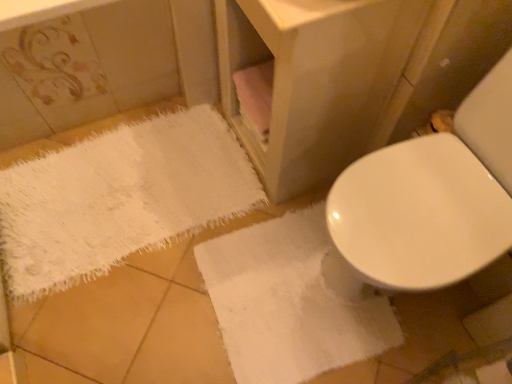
Question: Considering the positions of white fluffy bath towel at lower right, the first bath towel positioned from the right, and matte wood vanity at center in the image, is white fluffy bath towel at lower right, the first bath towel positioned from the right, wider or thinner than matte wood vanity at center?

Choices:
 (A) wide
 (B) thin

Answer: (A)

Question: In the image, is white fluffy bath towel at lower right, which is the second bath towel in left-to-right order, on the left side or the right side of matte wood vanity at center?

Choices:
 (A) right
 (B) left

Answer: (A)

Question: Considering the real-world distances, which object is closest to the white fluffy bath towel at lower right, which is the second bath towel in left-to-right order?

Choices:
 (A) white fluffy bath towel at lower left, the first bath towel positioned from the left
 (B) matte wood vanity at center

Answer: (A)

Question: Which of these objects is positioned farthest from the matte wood vanity at center?

Choices:
 (A) white fluffy bath towel at lower right, which is the second bath towel in left-to-right order
 (B) white fluffy bath towel at lower left, the first bath towel positioned from the left

Answer: (B)